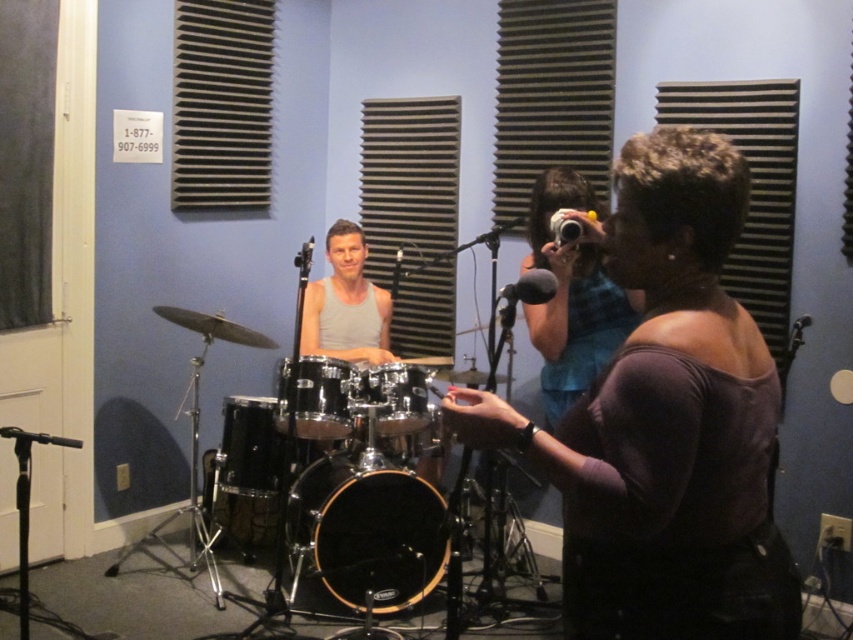
Can you confirm if black drum at center is positioned above black drum at lower center?

No, black drum at center is not above black drum at lower center.

What do you see at coordinates (363, 538) in the screenshot?
I see `black drum at center` at bounding box center [363, 538].

Find the location of `black drum at center`. black drum at center is located at coordinates (363, 538).

Can you confirm if dark purple fabric shirt at right is smaller than shiny chrome drum at center?

No.

Who is taller, dark purple fabric shirt at right or shiny chrome drum at center?

Standing taller between the two is dark purple fabric shirt at right.

Who is more distant from viewer, (x=728, y=412) or (x=395, y=420)?

The point (x=395, y=420) is more distant.

Find the location of a particular element. dark purple fabric shirt at right is located at coordinates (665, 422).

Is black drum at lower center below shiny black drum at center?

Correct, black drum at lower center is located below shiny black drum at center.

Is point (252, 440) less distant than point (332, 410)?

That is False.

Which is in front, point (281, 481) or point (296, 435)?

Point (296, 435) is more forward.

What are the coordinates of `black drum at lower center` in the screenshot? It's located at [250, 448].